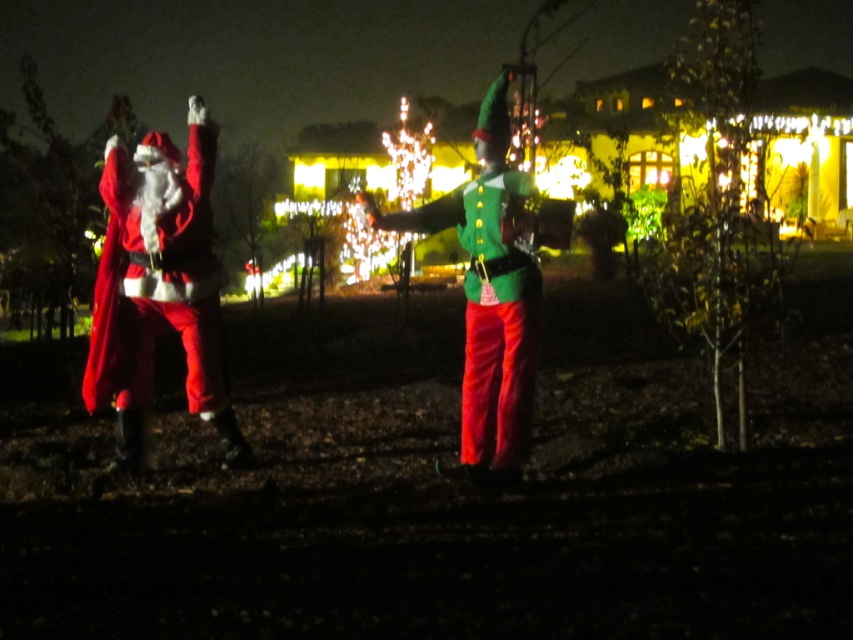
Question: Which point is farther to the camera?

Choices:
 (A) velvet red santa at left
 (B) green matte elf at center

Answer: (A)

Question: Does velvet red santa at left have a greater width compared to green matte elf at center?

Choices:
 (A) yes
 (B) no

Answer: (B)

Question: Which point is closer to the camera taking this photo?

Choices:
 (A) (503, 452)
 (B) (138, 141)

Answer: (A)

Question: Which point is farther from the camera taking this photo?

Choices:
 (A) (479, 115)
 (B) (194, 285)

Answer: (A)

Question: Considering the relative positions of velvet red santa at left and green matte elf at center in the image provided, where is velvet red santa at left located with respect to green matte elf at center?

Choices:
 (A) below
 (B) above

Answer: (A)

Question: Is velvet red santa at left wider than green matte elf at center?

Choices:
 (A) no
 (B) yes

Answer: (A)